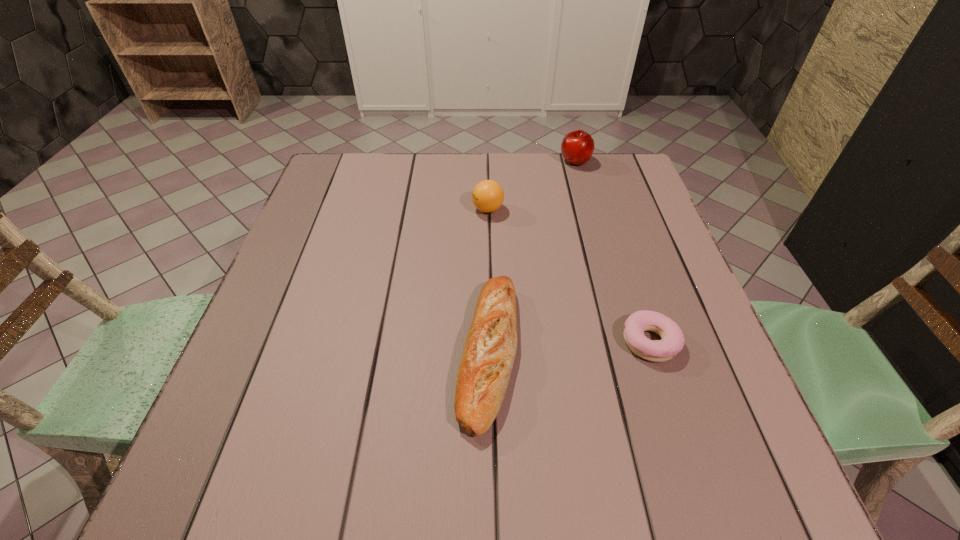
Locate an element on the screen. This screenshot has height=540, width=960. vacant area at the right edge is located at coordinates (640, 222).

I want to click on free space between the shortest object and the second shortest object, so click(569, 347).

The image size is (960, 540). In order to click on blank region between the farthest object and the second shortest object in this screenshot , I will do `click(532, 257)`.

Find the location of a particular element. free space that is in between the ping-pong ball and the farthest object is located at coordinates (532, 185).

Find the location of a particular element. This screenshot has width=960, height=540. blank region between the doughnut and the baguet is located at coordinates (569, 347).

Where is `vacant space in between the second tallest object and the second shortest object`? This screenshot has width=960, height=540. vacant space in between the second tallest object and the second shortest object is located at coordinates (488, 281).

At what (x,y) coordinates should I click in order to perform the action: click on vacant space in between the third tallest object and the ping-pong ball. Please return your answer as a coordinate pair (x, y). Image resolution: width=960 pixels, height=540 pixels. Looking at the image, I should click on (488, 281).

Locate an element on the screen. free spot between the doughnut and the third nearest object is located at coordinates (569, 275).

What are the coordinates of `free point between the doughnut and the tallest object` in the screenshot? It's located at (612, 252).

The height and width of the screenshot is (540, 960). I want to click on vacant point located between the tallest object and the third tallest object, so click(x=532, y=257).